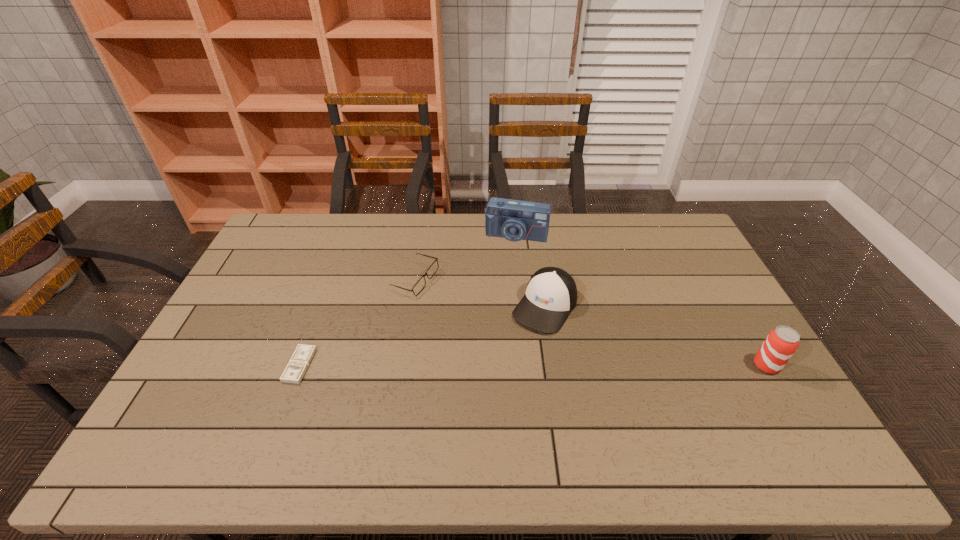
Find the location of `vacant area at the far edge`. vacant area at the far edge is located at coordinates (337, 220).

This screenshot has height=540, width=960. In order to click on vacant position at the near edge of the desktop in this screenshot , I will do `click(427, 394)`.

In the image, there is a desktop. Find the location of `vacant space at the left edge`. vacant space at the left edge is located at coordinates (211, 335).

The width and height of the screenshot is (960, 540). In the image, there is a desktop. Identify the location of vacant area at the right edge. (739, 389).

Where is `free region at the far left corner`? The height and width of the screenshot is (540, 960). free region at the far left corner is located at coordinates (292, 241).

The image size is (960, 540). Identify the location of vacant space at the far right corner of the desktop. (657, 244).

Identify the location of vacant area that lies between the spectacles and the beer can. The height and width of the screenshot is (540, 960). (590, 322).

The width and height of the screenshot is (960, 540). What are the coordinates of `blank region between the cap and the camera` in the screenshot? It's located at (531, 271).

This screenshot has width=960, height=540. I want to click on vacant space in between the farthest object and the money, so click(408, 300).

What are the coordinates of `free point between the rightmost object and the cap` in the screenshot? It's located at (656, 336).